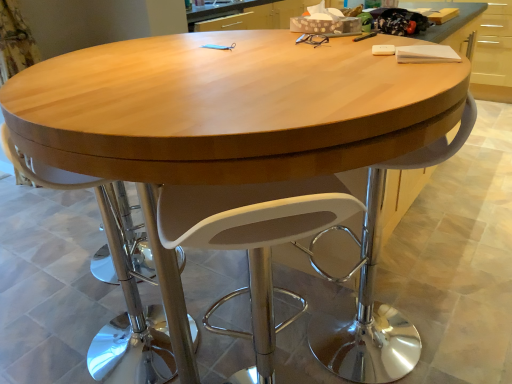
Locate an element on the screen. blank space to the left of white plastic chair at center is located at coordinates (52, 335).